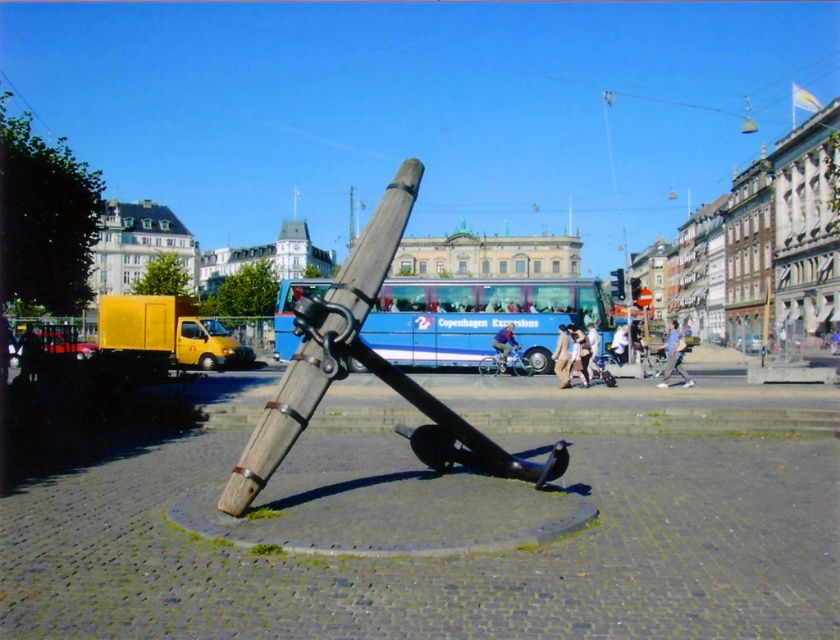
You are a tourist standing in the plaza and want to take a photo of the wooden anchor at center without the blue metallic bus at center appearing in the shot. Is it possible to do so given their relative sizes?

The wooden anchor at center is thinner than the blue metallic bus at center, so it might be possible to position yourself or adjust the camera angle to frame the anchor without the bus obstructing the view, as the anchor is narrower.

You are standing at the point marked by coordinates point (366,369) in the image. What object are you directly at?

You are directly at the wooden anchor at center, as the point (366,369) marks its location.